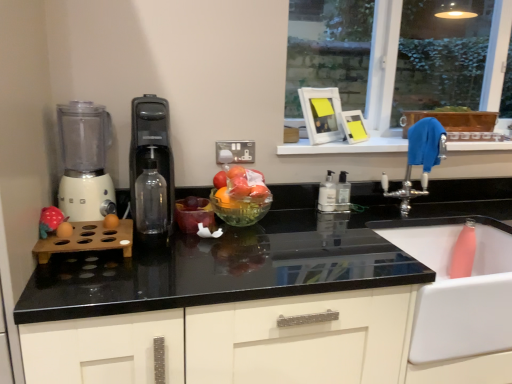
The image size is (512, 384). Find the location of `empty space that is ontop of transparent glass bowl at center (from a real-world perspective)`. empty space that is ontop of transparent glass bowl at center (from a real-world perspective) is located at coordinates (242, 178).